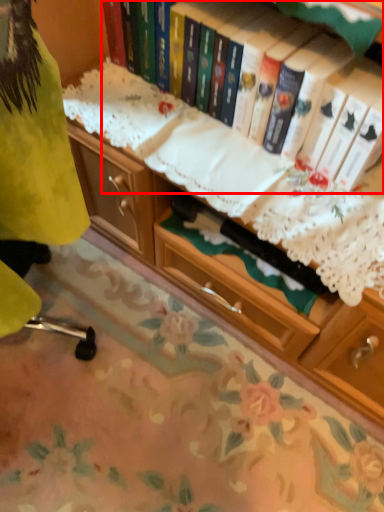
Question: From the image's perspective, where is book (annotated by the red box) located relative to tablecloth?

Choices:
 (A) above
 (B) below

Answer: (A)